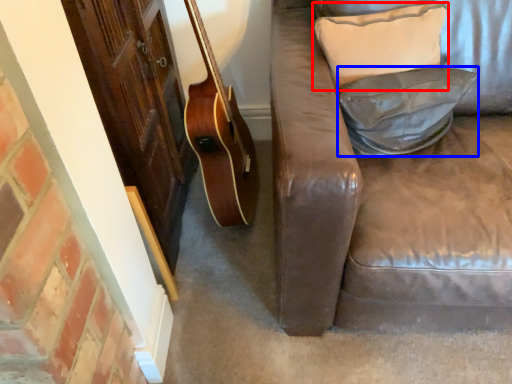
Question: Which object appears farthest to the camera in this image, pillow (highlighted by a red box) or pillow (highlighted by a blue box)?

Choices:
 (A) pillow
 (B) pillow

Answer: (A)